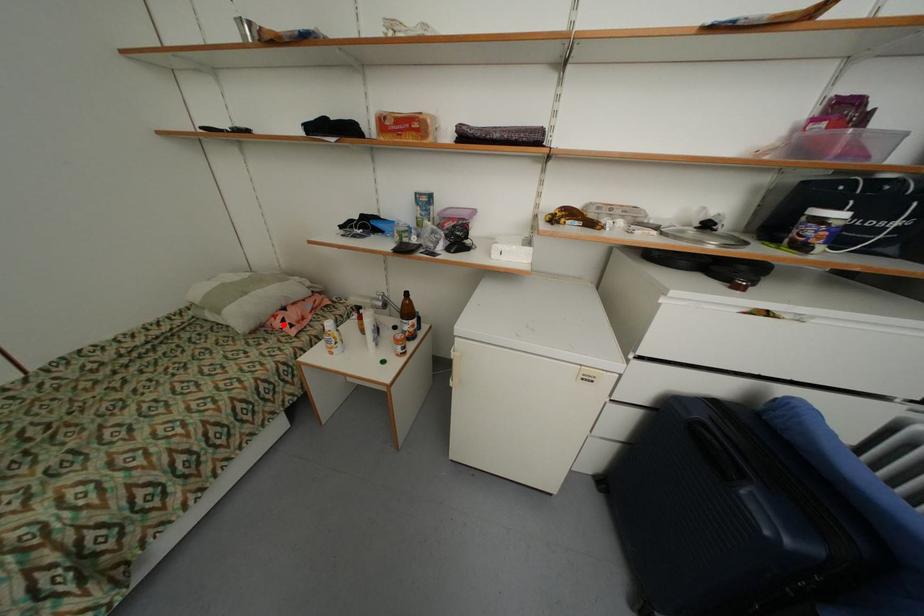
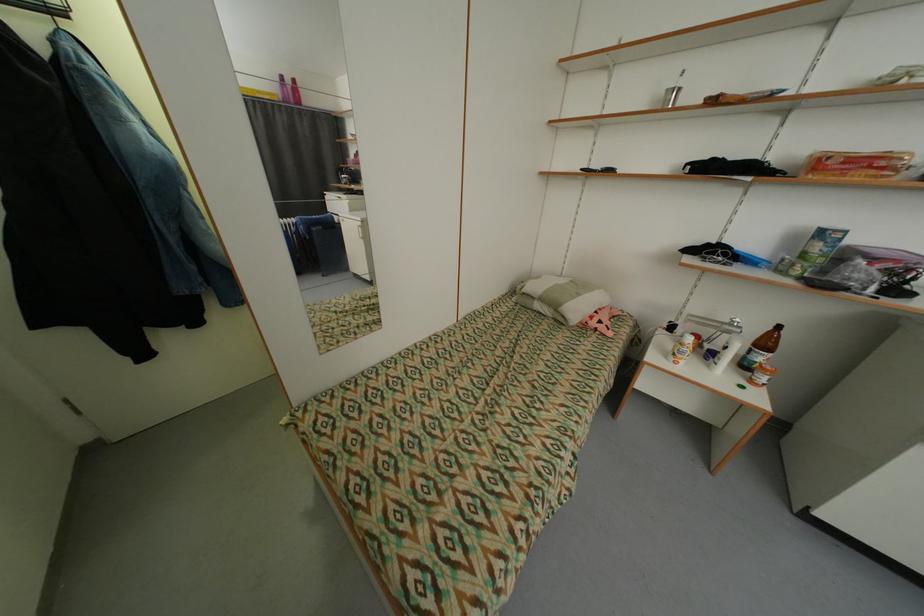
Question: I am providing you with two images of the same scene from different viewpoints. Image1 has a red point marked. In image2, the corresponding 3D location appears at what relative position? Reply with the corresponding letter.

Choices:
 (A) Closer
 (B) Farther

Answer: (B)